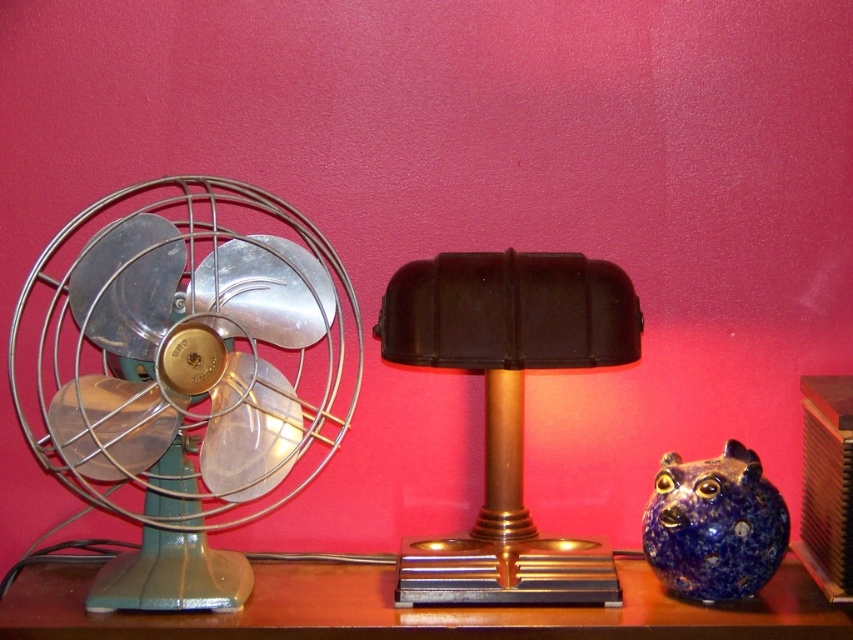
Who is positioned more to the left, black plastic table lamp at center or blue speckled ceramic piggy bank at lower right?

Positioned to the left is black plastic table lamp at center.

Is black plastic table lamp at center thinner than blue speckled ceramic piggy bank at lower right?

No.

Is point (527, 358) positioned behind point (666, 492)?

No, it is in front of (666, 492).

I want to click on black plastic table lamp at center, so click(508, 406).

Who is taller, metallic silver fan at left or blue speckled ceramic piggy bank at lower right?

With more height is metallic silver fan at left.

Who is more distant from viewer, (206, 388) or (717, 524)?

Positioned behind is point (717, 524).

Where is `metallic silver fan at left`? The image size is (853, 640). metallic silver fan at left is located at coordinates (186, 378).

Can you confirm if black plastic table lamp at center is positioned above metallic brown table at center?

Yes.

Who is taller, black plastic table lamp at center or metallic brown table at center?

black plastic table lamp at center is taller.

This screenshot has height=640, width=853. Identify the location of black plastic table lamp at center. (508, 406).